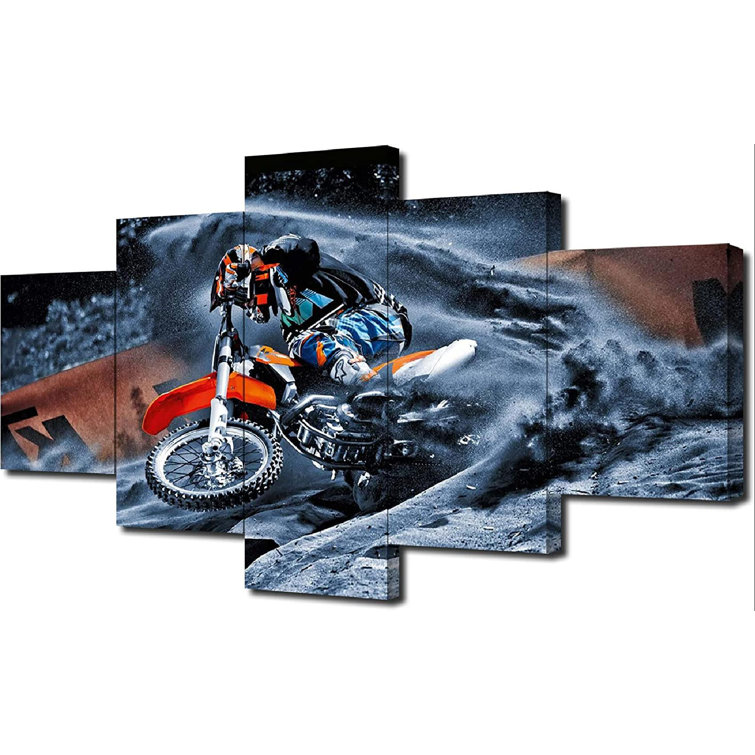
Identify the location of left edge section of picture. The image size is (755, 755). (50, 325).